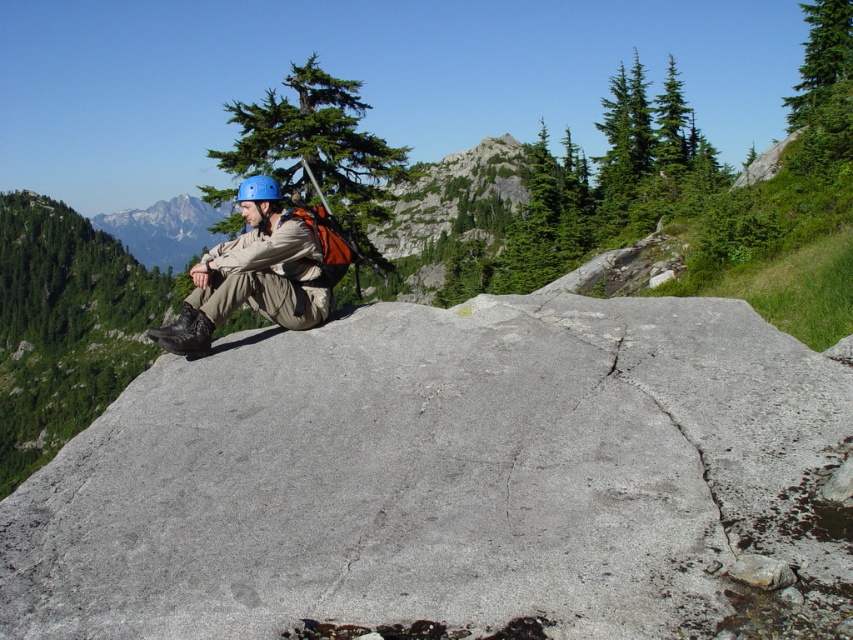
You are planning to place a small camping tent on the gray rough rock at center and the matte gray rock at center. Which rock would allow the tent to fit better based on their widths?

The matte gray rock at center has a greater width than the gray rough rock at center, so placing the tent on the matte gray rock at center would provide more space for the tent to fit better.

You are planning to place a small flag on the highest point between the matte blue helmet at center and the matte gray rock at center. Which object should you choose to place the flag on?

The matte gray rock at center is taller than the matte blue helmet at center, so you should place the flag on the matte gray rock at center.

You are a hiker who needs to cross from the gray rough rock at center to the matte gray rock at center. Given that your maximum jumping distance is 50 meters, can you make the jump safely?

The distance between the gray rough rock at center and the matte gray rock at center is 57.94 meters, which exceeds your maximum jumping distance of 50 meters. Therefore, you cannot make the jump safely.